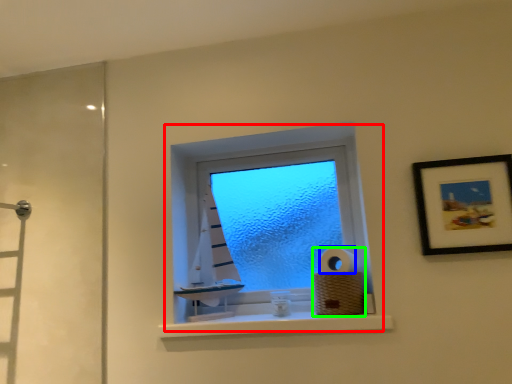
Question: Which is nearer to the window (highlighted by a red box)? toilet paper (highlighted by a blue box) or toilet paper (highlighted by a green box).

Choices:
 (A) toilet paper
 (B) toilet paper

Answer: (B)